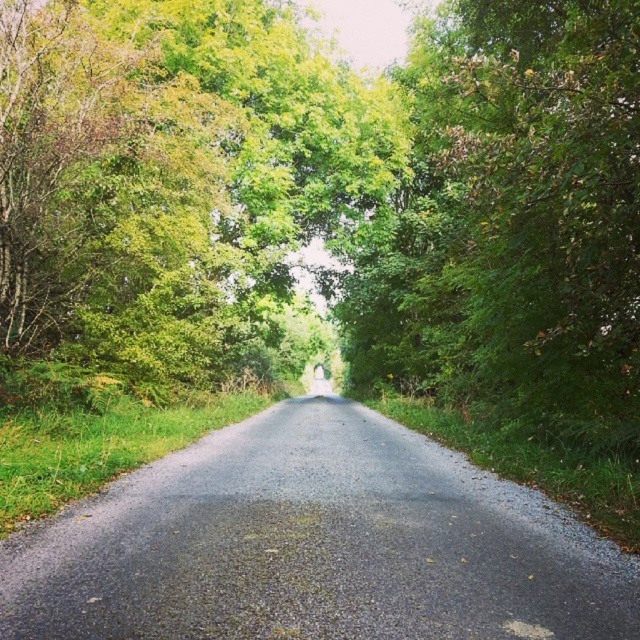
Question: Is green leafy tree at center to the right of black asphalt road at center from the viewer's perspective?

Choices:
 (A) yes
 (B) no

Answer: (B)

Question: Which object is closer to the camera taking this photo?

Choices:
 (A) green leafy tree at center
 (B) black asphalt road at center

Answer: (B)

Question: Does green leafy tree at center have a greater width compared to black asphalt road at center?

Choices:
 (A) yes
 (B) no

Answer: (A)

Question: Which object is closer to the camera taking this photo?

Choices:
 (A) green leafy tree at center
 (B) black asphalt road at center

Answer: (B)

Question: Observing the image, what is the correct spatial positioning of green leafy tree at center in reference to black asphalt road at center?

Choices:
 (A) above
 (B) below

Answer: (A)